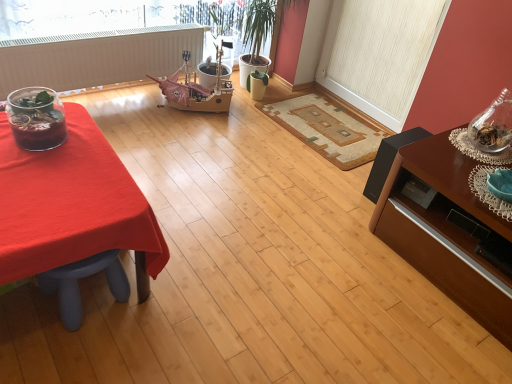
Image resolution: width=512 pixels, height=384 pixels. In order to click on free region on the left part of brown wood table at right in this screenshot , I will do `click(327, 245)`.